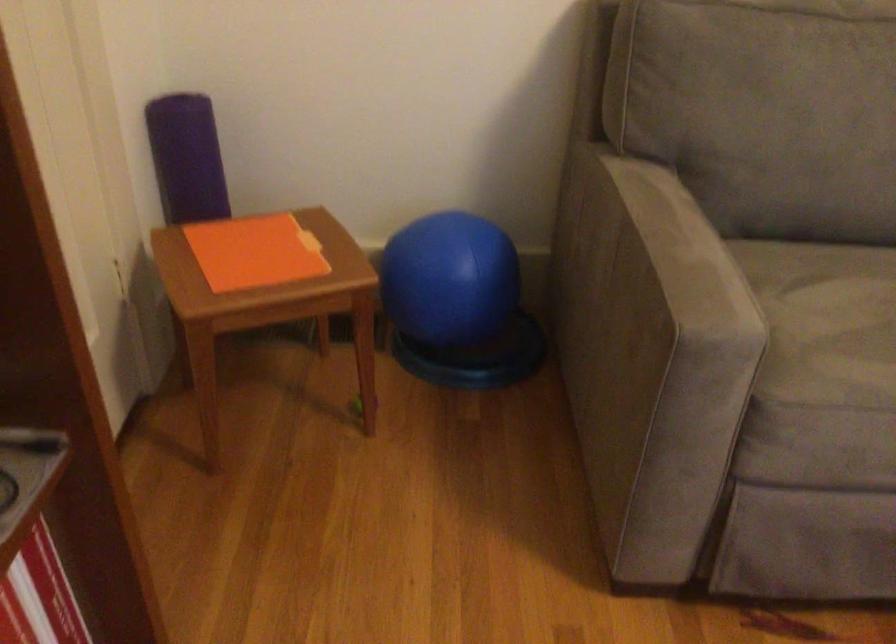
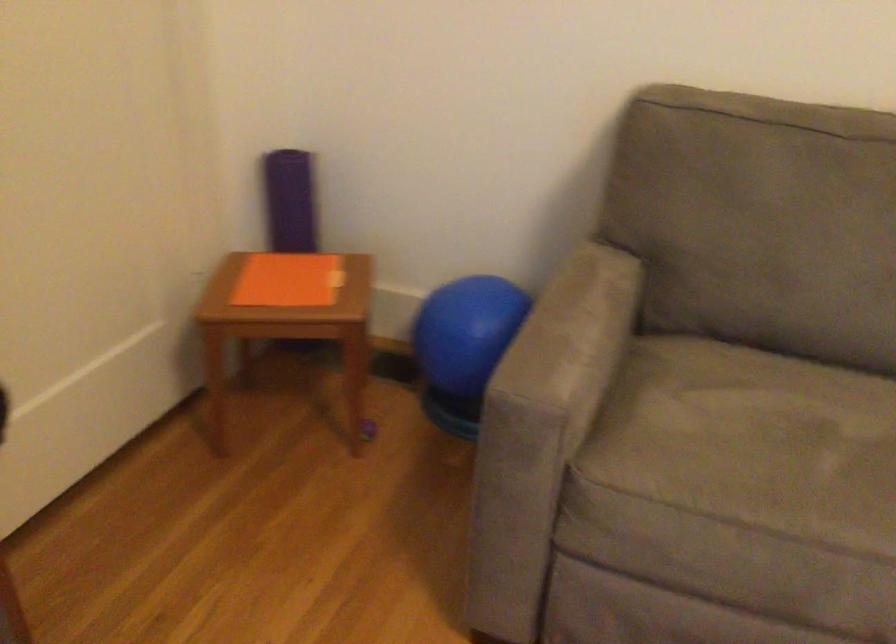
The point at (x=702, y=252) is marked in the first image. Where is the corresponding point in the second image?

(572, 333)